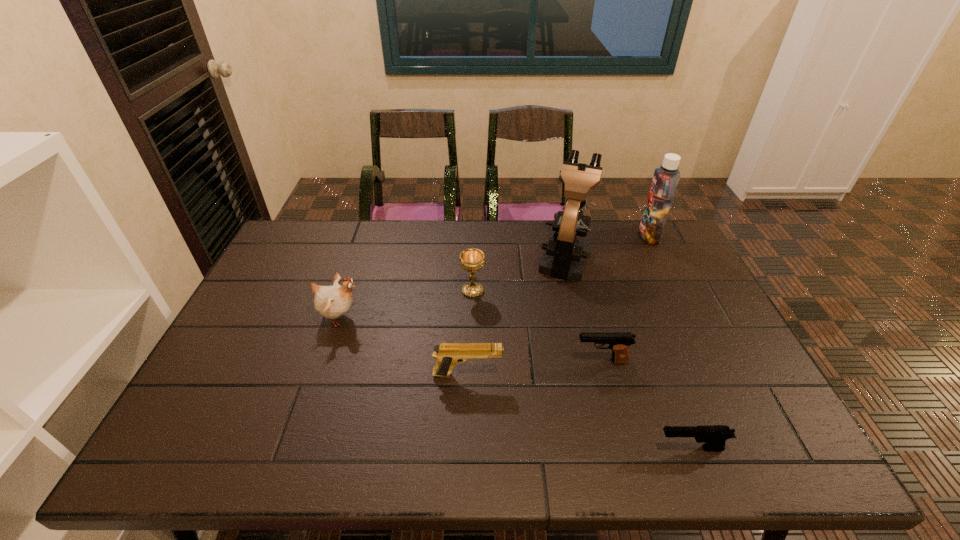
You are a GUI agent. You are given a task and a screenshot of the screen. Output one action in this format:
    pyautogui.click(x=<x>, y=<y>)
    Task: Click on the pistol object that ranks as the closest to the leftmost object
    The image size is (960, 540).
    Given the screenshot: What is the action you would take?
    pyautogui.click(x=447, y=354)